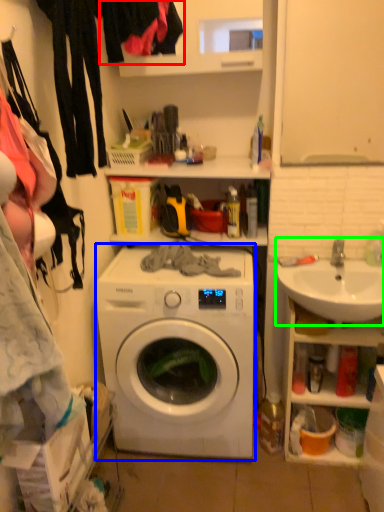
Question: Based on their relative distances, which object is farther from clothing (highlighted by a red box)? Choose from washing machine (highlighted by a blue box) and sink (highlighted by a green box).

Choices:
 (A) washing machine
 (B) sink

Answer: (B)